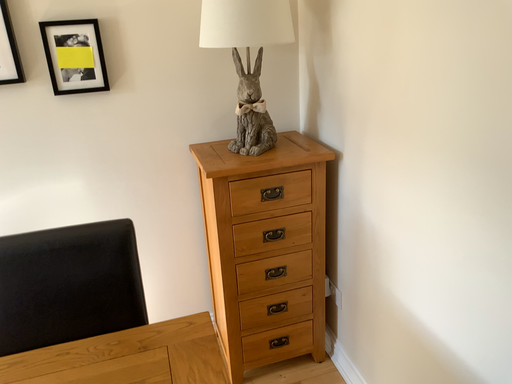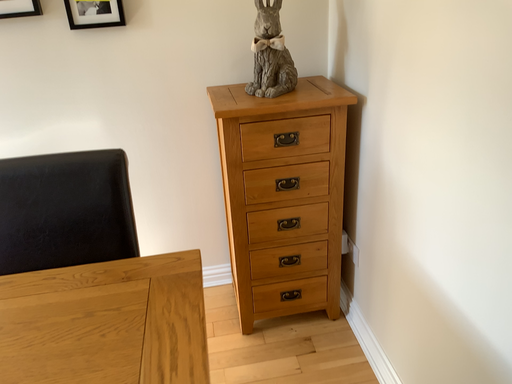
Question: Which way did the camera rotate in the video?

Choices:
 (A) rotated left
 (B) rotated right

Answer: (A)